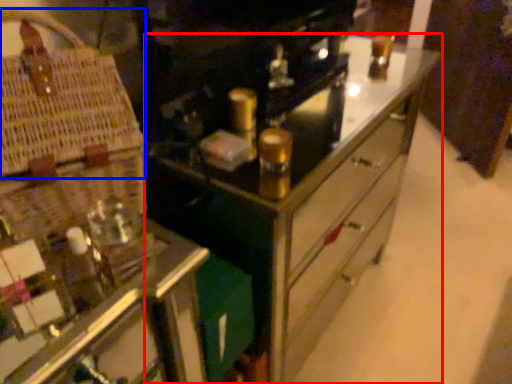
Question: Which object appears farthest to the camera in this image, chest of drawers (highlighted by a red box) or basket (highlighted by a blue box)?

Choices:
 (A) chest of drawers
 (B) basket

Answer: (A)